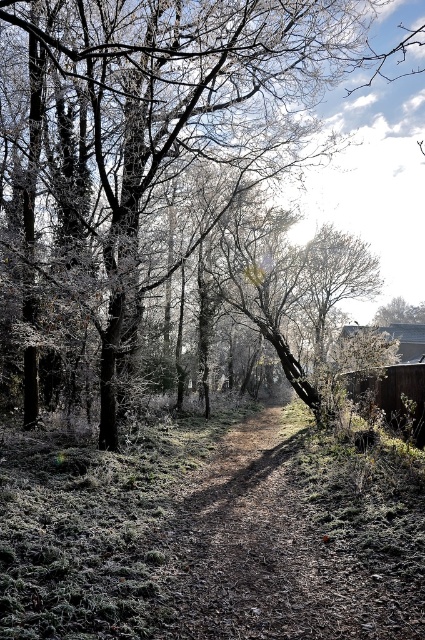
Question: Among these objects, which one is nearest to the camera?

Choices:
 (A) brown dirt track at center
 (B) glossy bark tree at center

Answer: (A)

Question: Is glossy bark tree at center positioned behind brown dirt track at center?

Choices:
 (A) yes
 (B) no

Answer: (A)

Question: Is glossy bark tree at center positioned before brown dirt track at center?

Choices:
 (A) yes
 (B) no

Answer: (B)

Question: Is glossy bark tree at center wider than brown dirt track at center?

Choices:
 (A) yes
 (B) no

Answer: (A)

Question: Among these points, which one is farthest from the camera?

Choices:
 (A) (351, 612)
 (B) (238, 124)

Answer: (B)